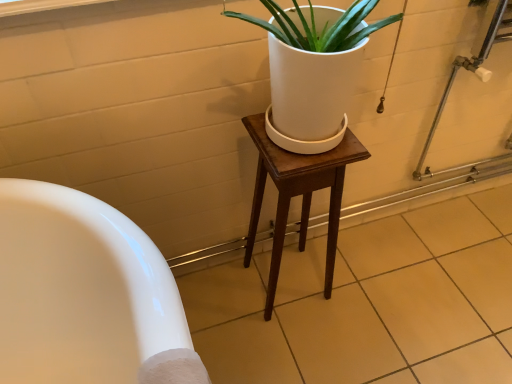
Where is `free space above white glossy tile at lower left (from a real-world perspective)`? This screenshot has width=512, height=384. free space above white glossy tile at lower left (from a real-world perspective) is located at coordinates (368, 300).